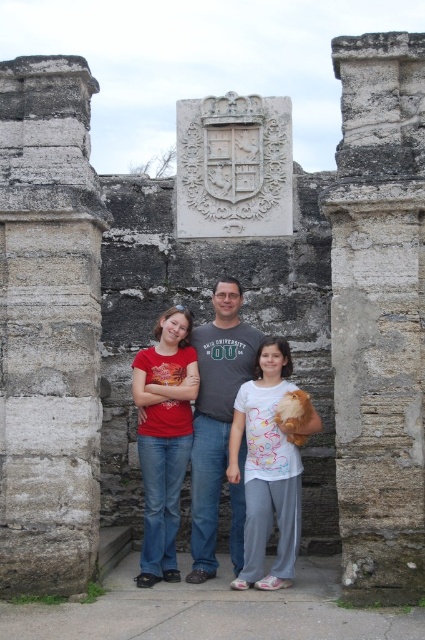
You are standing at the point marked as point [342,508] in the image. You want to take a photo of the stone structure with the three individuals in the background. Is the distance between you and the stone structure sufficient to capture the entire structure in one frame?

The point [342,508] and viewer are 151.55 feet apart from each other. Since the distance is quite large, it is likely that the entire stone structure can be captured in one frame from that position.

You are a tour guide explaining the historical site to visitors. You want to highlight the tallest object between the gray stone pillar at center and the matte gray stone family at center. Which one should you mention?

The gray stone pillar at center is taller than the matte gray stone family at center, so you should mention the gray stone pillar at center as the tallest object.